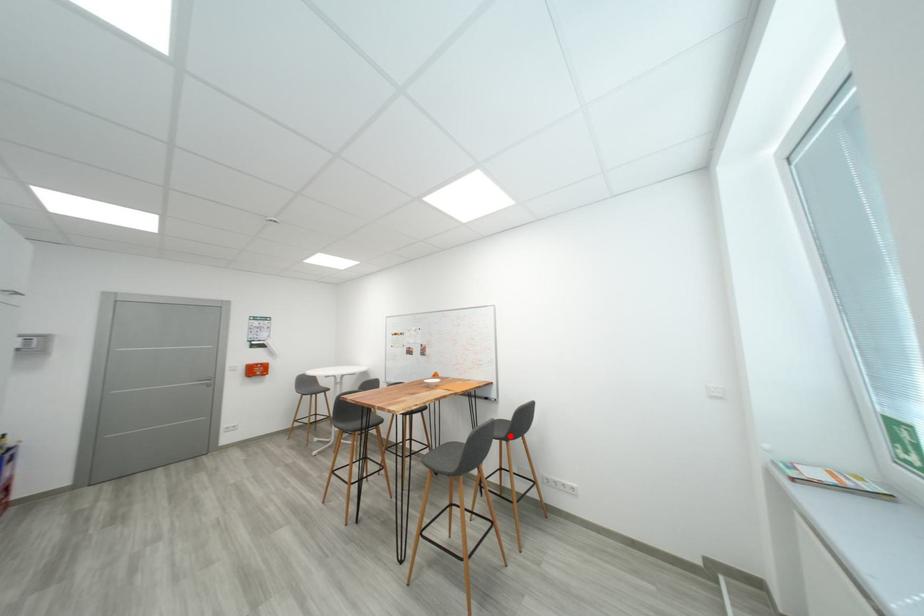
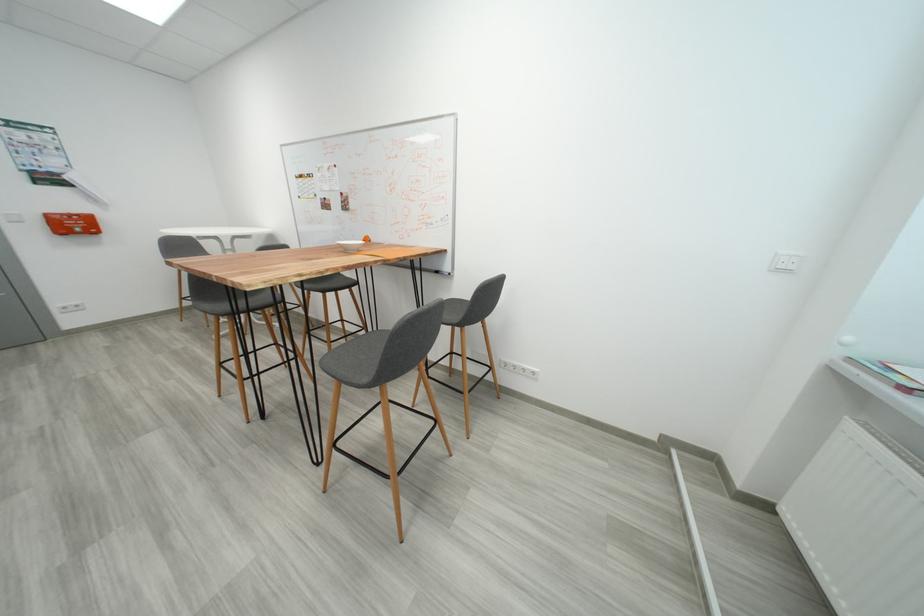
The point at the highlighted location is marked in the first image. Where is the corresponding point in the second image?

(464, 320)